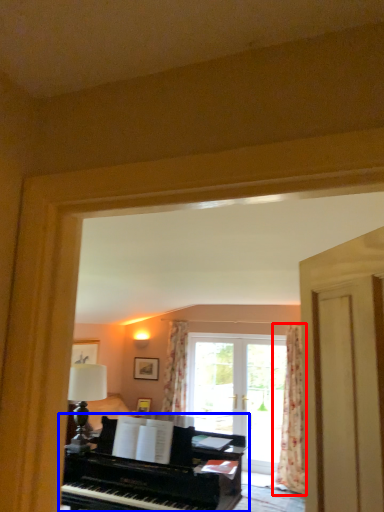
Question: Which point is further to the camera, curtain (highlighted by a red box) or piano (highlighted by a blue box)?

Choices:
 (A) curtain
 (B) piano

Answer: (A)